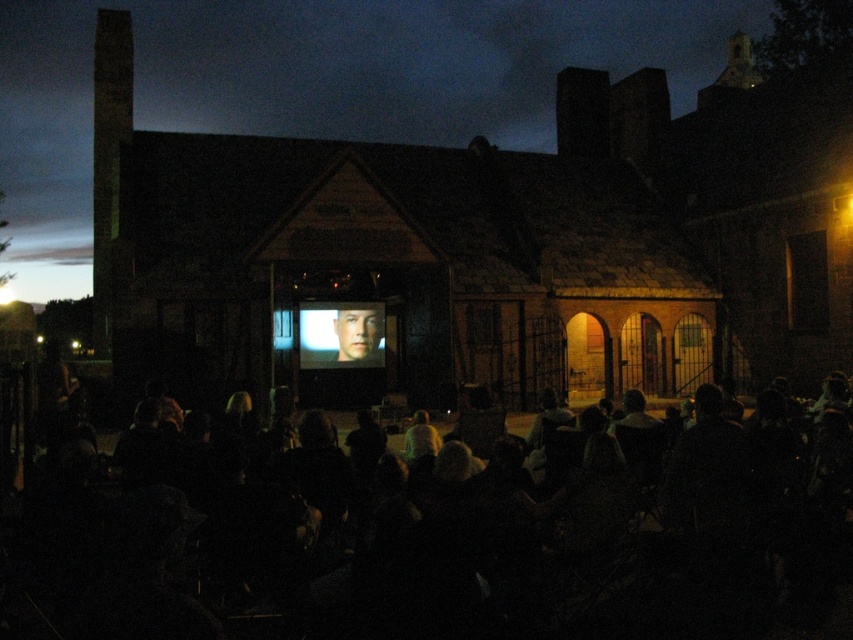
Is black fabric chairs at lower center above matte silver screen at center?

No.

Can you confirm if black fabric chairs at lower center is shorter than matte silver screen at center?

Incorrect, black fabric chairs at lower center's height does not fall short of matte silver screen at center's.

Between point (78, 572) and point (352, 340), which one is positioned behind?

Point (352, 340)

In order to click on black fabric chairs at lower center in this screenshot , I will do `click(440, 552)`.